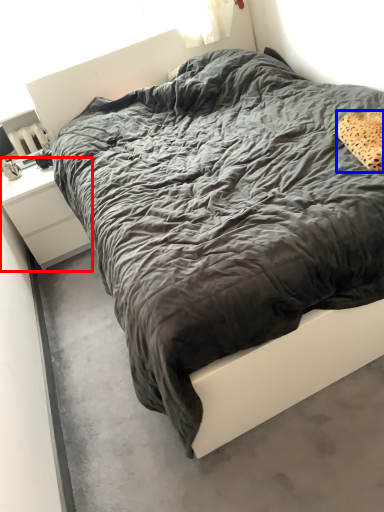
Question: Which point is further to the camera, nightstand (highlighted by a red box) or pillow (highlighted by a blue box)?

Choices:
 (A) nightstand
 (B) pillow

Answer: (A)